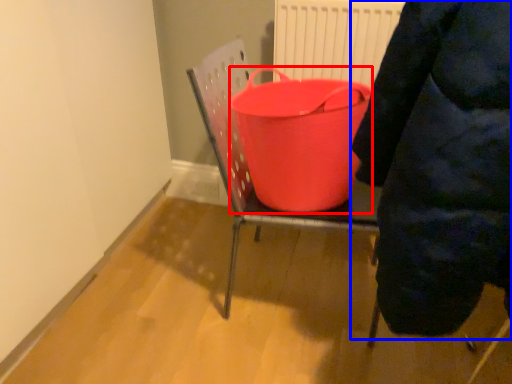
Question: Which object is further to the camera taking this photo, basin (highlighted by a red box) or person (highlighted by a blue box)?

Choices:
 (A) basin
 (B) person

Answer: (A)